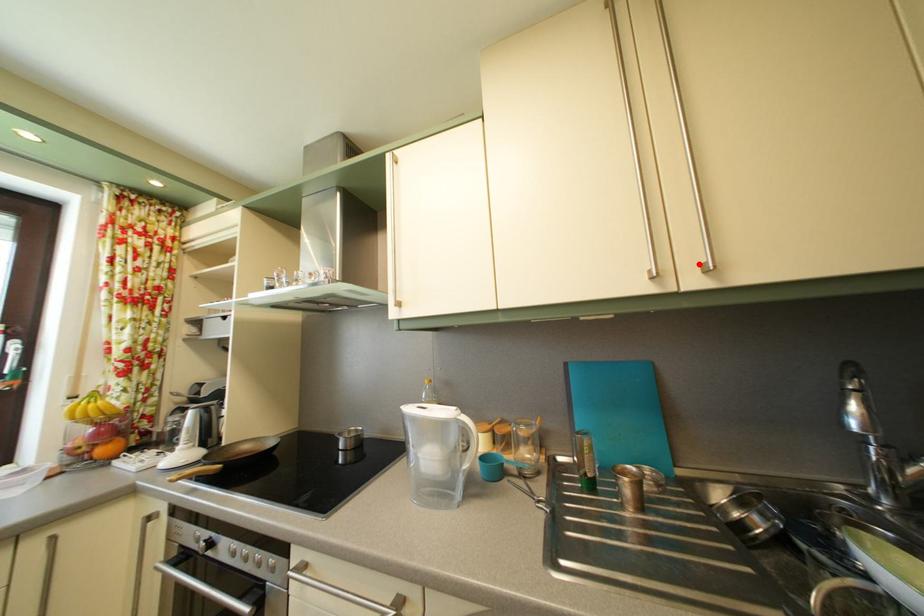
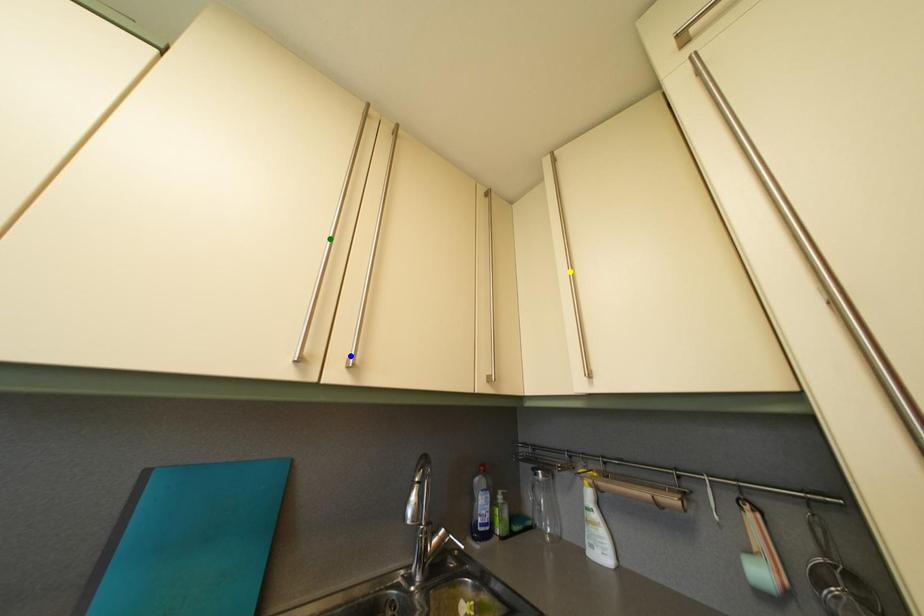
Question: I am providing you with two images of the same scene from different viewpoints. A red point is marked on the first image. You are given multiple points on the second image. Which mark in image 2 goes with the point in image 1?

Choices:
 (A) blue point
 (B) green point
 (C) yellow point

Answer: (A)